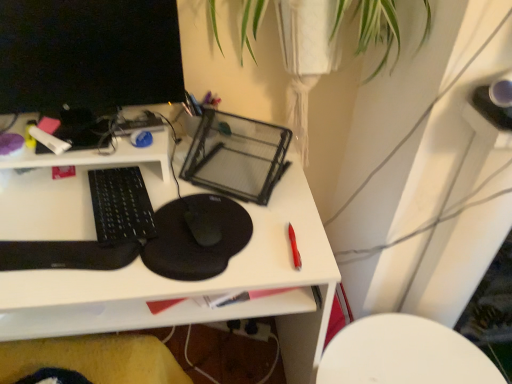
At what (x,y) coordinates should I click in order to perform the action: click on vacant area on the back side of black matte mousepad at center. Please return your answer as a coordinate pair (x, y). Looking at the image, I should click on (217, 168).